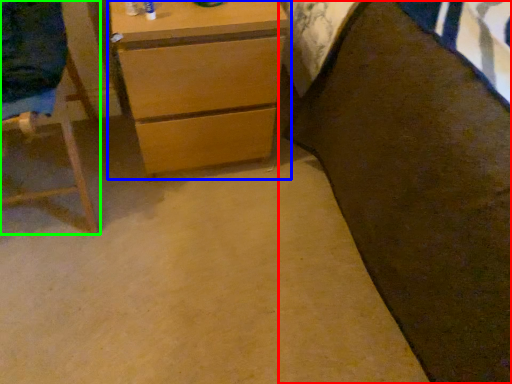
Question: Based on their relative distances, which object is farther from bed (highlighted by a red box)? Choose from chest of drawers (highlighted by a blue box) and furniture (highlighted by a green box).

Choices:
 (A) chest of drawers
 (B) furniture

Answer: (B)